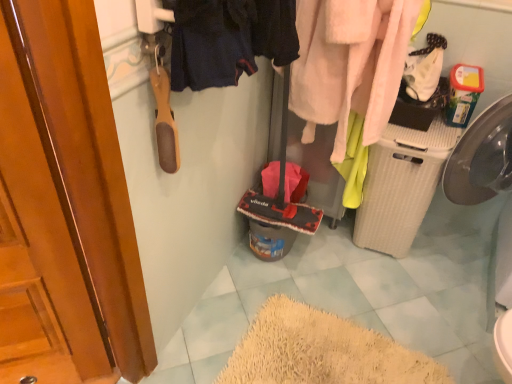
What do you see at coordinates (211, 43) in the screenshot? I see `dark blue fabric at upper center, the 1th clothing from the front` at bounding box center [211, 43].

You are a GUI agent. You are given a task and a screenshot of the screen. Output one action in this format:
    pyautogui.click(x=<x>, y=<y>)
    Task: Click on the dark blue fabric at upper center, acting as the 2th clothing starting from the back
    
    Given the screenshot: What is the action you would take?
    pyautogui.click(x=211, y=43)

Find the location of a particular element. fuzzy pink towel at upper right, placed as the second clothing when sorted from left to right is located at coordinates (349, 64).

Measure the distance between point [374,21] and camera.

Point [374,21] and camera are 1.24 meters apart.

The image size is (512, 384). What do you see at coordinates (349, 64) in the screenshot?
I see `fuzzy pink towel at upper right, acting as the first clothing starting from the right` at bounding box center [349, 64].

The height and width of the screenshot is (384, 512). In order to click on dark blue fabric at upper center, placed as the 2th clothing when sorted from right to left in this screenshot , I will do `click(211, 43)`.

Does dark blue fabric at upper center, placed as the 2th clothing when sorted from right to left, appear on the right side of fuzzy pink towel at upper right, positioned as the second clothing in front-to-back order?

No, dark blue fabric at upper center, placed as the 2th clothing when sorted from right to left, is not to the right of fuzzy pink towel at upper right, positioned as the second clothing in front-to-back order.

Which object is closer to the camera, dark blue fabric at upper center, acting as the 2th clothing starting from the back, or fuzzy pink towel at upper right, positioned as the second clothing in front-to-back order?

dark blue fabric at upper center, acting as the 2th clothing starting from the back, is in front.

Considering the positions of points (237, 36) and (360, 9), is point (237, 36) closer to camera compared to point (360, 9)?

Yes, point (237, 36) is closer to viewer.

Consider the image. From the image's perspective, is dark blue fabric at upper center, placed as the 2th clothing when sorted from right to left, located above or below fuzzy pink towel at upper right, which is the 1th clothing from back to front?

From the image's perspective, dark blue fabric at upper center, placed as the 2th clothing when sorted from right to left, appears below fuzzy pink towel at upper right, which is the 1th clothing from back to front.

From a real-world perspective, is dark blue fabric at upper center, acting as the 2th clothing starting from the back, positioned above or below fuzzy pink towel at upper right, positioned as the second clothing in front-to-back order?

dark blue fabric at upper center, acting as the 2th clothing starting from the back, is above fuzzy pink towel at upper right, positioned as the second clothing in front-to-back order.

Considering the sizes of objects dark blue fabric at upper center, which is counted as the 1th clothing, starting from the left, and fuzzy pink towel at upper right, positioned as the second clothing in front-to-back order, in the image provided, who is thinner, dark blue fabric at upper center, which is counted as the 1th clothing, starting from the left, or fuzzy pink towel at upper right, positioned as the second clothing in front-to-back order,?

dark blue fabric at upper center, which is counted as the 1th clothing, starting from the left.

Is dark blue fabric at upper center, acting as the 2th clothing starting from the back, taller than fuzzy pink towel at upper right, positioned as the second clothing in front-to-back order?

No, dark blue fabric at upper center, acting as the 2th clothing starting from the back, is not taller than fuzzy pink towel at upper right, positioned as the second clothing in front-to-back order.

Who is smaller, dark blue fabric at upper center, acting as the 2th clothing starting from the back, or fuzzy pink towel at upper right, positioned as the second clothing in front-to-back order?

Smaller between the two is dark blue fabric at upper center, acting as the 2th clothing starting from the back.

Based on the photo, do you think dark blue fabric at upper center, placed as the 2th clothing when sorted from right to left, is within fuzzy pink towel at upper right, acting as the first clothing starting from the right, or outside of it?

dark blue fabric at upper center, placed as the 2th clothing when sorted from right to left, is outside fuzzy pink towel at upper right, acting as the first clothing starting from the right.

Is dark blue fabric at upper center, the 1th clothing from the front, next to fuzzy pink towel at upper right, which is the 1th clothing from back to front?

No, dark blue fabric at upper center, the 1th clothing from the front, is not making contact with fuzzy pink towel at upper right, which is the 1th clothing from back to front.

Is dark blue fabric at upper center, the 1th clothing from the front, turned away from fuzzy pink towel at upper right, placed as the second clothing when sorted from left to right?

dark blue fabric at upper center, the 1th clothing from the front, does not have its back to fuzzy pink towel at upper right, placed as the second clothing when sorted from left to right.

Where is `clothing that is in front of the fuzzy pink towel at upper right, placed as the second clothing when sorted from left to right`? This screenshot has height=384, width=512. clothing that is in front of the fuzzy pink towel at upper right, placed as the second clothing when sorted from left to right is located at coordinates (211, 43).

Considering the relative positions of fuzzy pink towel at upper right, acting as the first clothing starting from the right, and dark blue fabric at upper center, which is counted as the 1th clothing, starting from the left, in the image provided, is fuzzy pink towel at upper right, acting as the first clothing starting from the right, to the right of dark blue fabric at upper center, which is counted as the 1th clothing, starting from the left, from the viewer's perspective?

Indeed, fuzzy pink towel at upper right, acting as the first clothing starting from the right, is positioned on the right side of dark blue fabric at upper center, which is counted as the 1th clothing, starting from the left.

Looking at this image, which is in front, fuzzy pink towel at upper right, positioned as the second clothing in front-to-back order, or dark blue fabric at upper center, placed as the 2th clothing when sorted from right to left?

dark blue fabric at upper center, placed as the 2th clothing when sorted from right to left, is more forward.

Considering the positions of point (399, 9) and point (248, 6), is point (399, 9) closer or farther from the camera than point (248, 6)?

Point (399, 9) is positioned farther from the camera compared to point (248, 6).

From the image's perspective, is fuzzy pink towel at upper right, acting as the first clothing starting from the right, above or below dark blue fabric at upper center, acting as the 2th clothing starting from the back?

fuzzy pink towel at upper right, acting as the first clothing starting from the right, is situated higher than dark blue fabric at upper center, acting as the 2th clothing starting from the back, in the image.

From a real-world perspective, between fuzzy pink towel at upper right, positioned as the second clothing in front-to-back order, and dark blue fabric at upper center, which is counted as the 1th clothing, starting from the left, who is vertically higher?

dark blue fabric at upper center, which is counted as the 1th clothing, starting from the left.

Considering the sizes of objects fuzzy pink towel at upper right, placed as the second clothing when sorted from left to right, and dark blue fabric at upper center, placed as the 2th clothing when sorted from right to left, in the image provided, who is wider, fuzzy pink towel at upper right, placed as the second clothing when sorted from left to right, or dark blue fabric at upper center, placed as the 2th clothing when sorted from right to left,?

fuzzy pink towel at upper right, placed as the second clothing when sorted from left to right, is wider.

Considering the sizes of fuzzy pink towel at upper right, positioned as the second clothing in front-to-back order, and dark blue fabric at upper center, placed as the 2th clothing when sorted from right to left, in the image, is fuzzy pink towel at upper right, positioned as the second clothing in front-to-back order, taller or shorter than dark blue fabric at upper center, placed as the 2th clothing when sorted from right to left,?

In the image, fuzzy pink towel at upper right, positioned as the second clothing in front-to-back order, appears to be taller than dark blue fabric at upper center, placed as the 2th clothing when sorted from right to left.

Considering the sizes of fuzzy pink towel at upper right, positioned as the second clothing in front-to-back order, and dark blue fabric at upper center, acting as the 2th clothing starting from the back, in the image, is fuzzy pink towel at upper right, positioned as the second clothing in front-to-back order, bigger or smaller than dark blue fabric at upper center, acting as the 2th clothing starting from the back,?

Considering their sizes, fuzzy pink towel at upper right, positioned as the second clothing in front-to-back order, takes up more space than dark blue fabric at upper center, acting as the 2th clothing starting from the back.

Based on the photo, is dark blue fabric at upper center, the 1th clothing from the front, surrounded by fuzzy pink towel at upper right, which is the 1th clothing from back to front?

No.

Is fuzzy pink towel at upper right, positioned as the second clothing in front-to-back order, with dark blue fabric at upper center, acting as the 2th clothing starting from the back?

fuzzy pink towel at upper right, positioned as the second clothing in front-to-back order, and dark blue fabric at upper center, acting as the 2th clothing starting from the back, are clearly separated.

Is fuzzy pink towel at upper right, positioned as the second clothing in front-to-back order, facing away from dark blue fabric at upper center, acting as the 2th clothing starting from the back?

fuzzy pink towel at upper right, positioned as the second clothing in front-to-back order, does not have its back to dark blue fabric at upper center, acting as the 2th clothing starting from the back.

The image size is (512, 384). What are the coordinates of `clothing that is below the fuzzy pink towel at upper right, which is the 1th clothing from back to front (from the image's perspective)` in the screenshot? It's located at (211, 43).

Locate an element on the screen. The height and width of the screenshot is (384, 512). clothing on the left of fuzzy pink towel at upper right, which is the 1th clothing from back to front is located at coordinates (211, 43).

This screenshot has width=512, height=384. In order to click on clothing located above the dark blue fabric at upper center, the 1th clothing from the front (from the image's perspective) in this screenshot , I will do `click(349, 64)`.